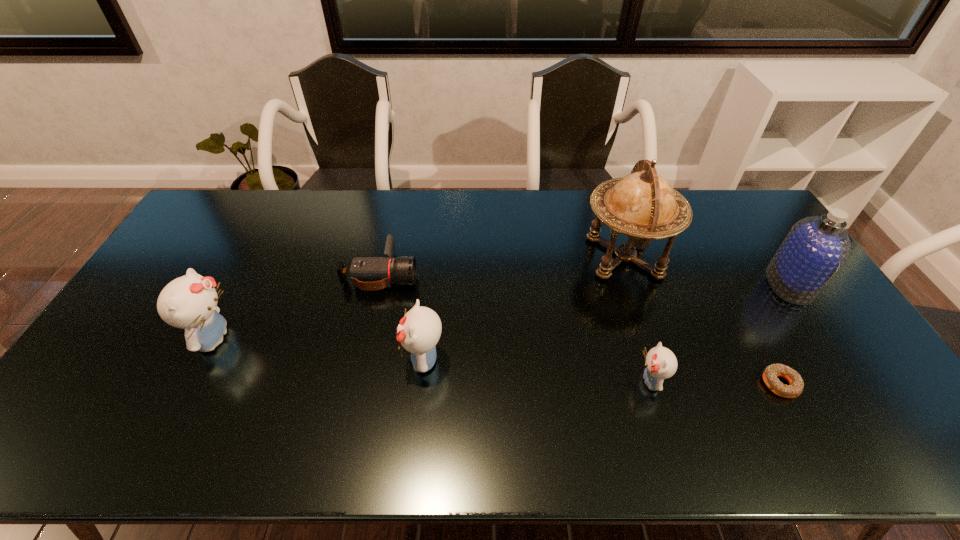
In the image, there is a desktop. In order to click on vacant space at the right edge in this screenshot , I will do `click(867, 361)`.

I want to click on vacant space at the far left corner of the desktop, so (224, 190).

This screenshot has height=540, width=960. What are the coordinates of `vacant region at the near right corner of the desktop` in the screenshot? It's located at (875, 387).

What are the coordinates of `free space between the third shortest object and the rightmost object` in the screenshot? It's located at (720, 333).

The height and width of the screenshot is (540, 960). I want to click on free space that is in between the tallest object and the second shortest kitten, so click(524, 308).

The width and height of the screenshot is (960, 540). I want to click on free spot between the shortest object and the tallest object, so click(703, 321).

At what (x,y) coordinates should I click in order to perform the action: click on free point between the sixth object from left to right and the globe. Please return your answer as a coordinate pair (x, y). Looking at the image, I should click on (703, 321).

What are the coordinates of `vacant space in between the sixth tallest object and the fifth tallest object` in the screenshot? It's located at (516, 327).

Locate an element on the screen. This screenshot has width=960, height=540. vacant space that is in between the shortest object and the globe is located at coordinates (703, 321).

Locate an element on the screen. free space between the sixth object from left to right and the third shortest object is located at coordinates click(715, 382).